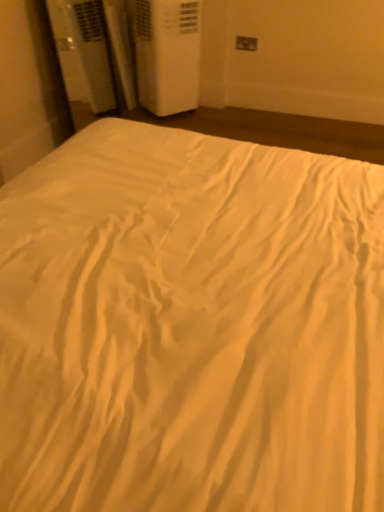
Identify the location of white plastic air conditioner at upper left. (166, 54).

The width and height of the screenshot is (384, 512). Describe the element at coordinates (166, 54) in the screenshot. I see `white plastic air conditioner at upper left` at that location.

What is the approximate width of white plastic air conditioner at upper left?

The width of white plastic air conditioner at upper left is 20.26 inches.

You are a GUI agent. You are given a task and a screenshot of the screen. Output one action in this format:
    pyautogui.click(x=<x>, y=<y>)
    Task: Click on the matte white electric outlet at upper right
    
    Given the screenshot: What is the action you would take?
    pyautogui.click(x=246, y=42)

What do you see at coordinates (246, 42) in the screenshot?
I see `matte white electric outlet at upper right` at bounding box center [246, 42].

Where is `white plastic air conditioner at upper left`? white plastic air conditioner at upper left is located at coordinates (166, 54).

Between white plastic air conditioner at upper left and matte white electric outlet at upper right, which one appears on the left side from the viewer's perspective?

From the viewer's perspective, white plastic air conditioner at upper left appears more on the left side.

In the image, is white plastic air conditioner at upper left positioned in front of or behind matte white electric outlet at upper right?

white plastic air conditioner at upper left is in front of matte white electric outlet at upper right.

Is point (190, 87) farther from camera compared to point (240, 42)?

Yes.

From the image's perspective, is white plastic air conditioner at upper left under matte white electric outlet at upper right?

Yes.

From a real-world perspective, is white plastic air conditioner at upper left located higher than matte white electric outlet at upper right?

No, from a real-world perspective, white plastic air conditioner at upper left is not above matte white electric outlet at upper right.

In terms of width, does white plastic air conditioner at upper left look wider or thinner when compared to matte white electric outlet at upper right?

white plastic air conditioner at upper left is wider than matte white electric outlet at upper right.

Which of these two, white plastic air conditioner at upper left or matte white electric outlet at upper right, stands shorter?

matte white electric outlet at upper right is shorter.

Is white plastic air conditioner at upper left smaller than matte white electric outlet at upper right?

Incorrect, white plastic air conditioner at upper left is not smaller in size than matte white electric outlet at upper right.

Would you say white plastic air conditioner at upper left is inside or outside matte white electric outlet at upper right?

white plastic air conditioner at upper left is not enclosed by matte white electric outlet at upper right.

Is white plastic air conditioner at upper left far from matte white electric outlet at upper right?

No, there isn't a large distance between white plastic air conditioner at upper left and matte white electric outlet at upper right.

Is white plastic air conditioner at upper left turned away from matte white electric outlet at upper right?

white plastic air conditioner at upper left does not have its back to matte white electric outlet at upper right.

Can you tell me how much white plastic air conditioner at upper left and matte white electric outlet at upper right differ in facing direction?

The angular difference between white plastic air conditioner at upper left and matte white electric outlet at upper right is 1.26 degrees.

Locate an element on the screen. air conditioning in front of the matte white electric outlet at upper right is located at coordinates (166, 54).

Between matte white electric outlet at upper right and white plastic air conditioner at upper left, which one appears on the left side from the viewer's perspective?

From the viewer's perspective, white plastic air conditioner at upper left appears more on the left side.

Is the position of matte white electric outlet at upper right less distant than that of white plastic air conditioner at upper left?

No, the depth of matte white electric outlet at upper right is greater than that of white plastic air conditioner at upper left.

Does point (247, 41) lie behind point (183, 39)?

That is True.

From the image's perspective, would you say matte white electric outlet at upper right is positioned over white plastic air conditioner at upper left?

Indeed, from the image's perspective, matte white electric outlet at upper right is shown above white plastic air conditioner at upper left.

From a real-world perspective, which object rests below the other?

white plastic air conditioner at upper left is physically lower.

Looking at this image, is matte white electric outlet at upper right thinner than white plastic air conditioner at upper left?

Yes, matte white electric outlet at upper right is thinner than white plastic air conditioner at upper left.

From their relative heights in the image, would you say matte white electric outlet at upper right is taller or shorter than white plastic air conditioner at upper left?

matte white electric outlet at upper right is shorter than white plastic air conditioner at upper left.

Considering the relative sizes of matte white electric outlet at upper right and white plastic air conditioner at upper left in the image provided, is matte white electric outlet at upper right smaller than white plastic air conditioner at upper left?

Yes.

Looking at this image, which is correct: matte white electric outlet at upper right is inside white plastic air conditioner at upper left, or outside of it?

matte white electric outlet at upper right cannot be found inside white plastic air conditioner at upper left.

Is matte white electric outlet at upper right beside white plastic air conditioner at upper left?

They are not placed beside each other.

In the scene shown: Could you tell me if matte white electric outlet at upper right is facing white plastic air conditioner at upper left?

No, matte white electric outlet at upper right is not facing towards white plastic air conditioner at upper left.

What are the coordinates of `air conditioning below the matte white electric outlet at upper right (from a real-world perspective)` in the screenshot? It's located at (166, 54).

This screenshot has width=384, height=512. I want to click on air conditioning located underneath the matte white electric outlet at upper right (from a real-world perspective), so click(166, 54).

At what (x,y) coordinates should I click in order to perform the action: click on electric outlet above the white plastic air conditioner at upper left (from a real-world perspective). Please return your answer as a coordinate pair (x, y). The width and height of the screenshot is (384, 512). Looking at the image, I should click on (246, 42).